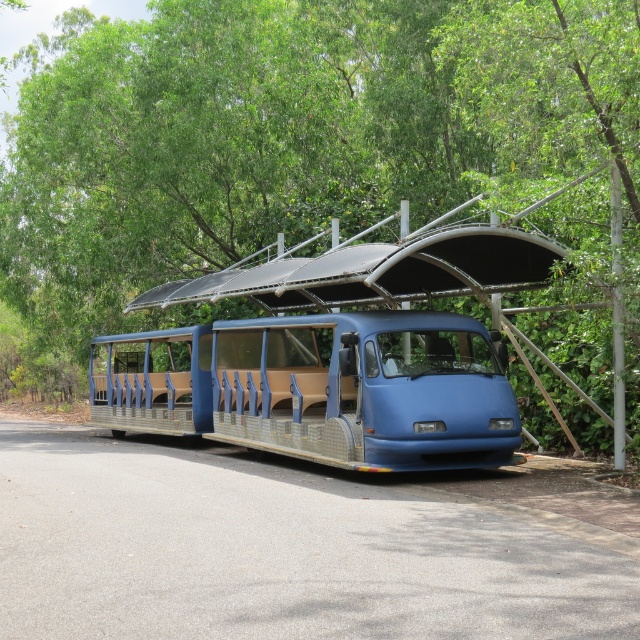
Does green leafy tree at upper center appear on the left side of blue matte/tactile tour bus at center?

Correct, you'll find green leafy tree at upper center to the left of blue matte/tactile tour bus at center.

Does green leafy tree at upper center appear over blue matte/tactile tour bus at center?

Yes, green leafy tree at upper center is above blue matte/tactile tour bus at center.

This screenshot has height=640, width=640. What do you see at coordinates (296, 138) in the screenshot? I see `green leafy tree at upper center` at bounding box center [296, 138].

The width and height of the screenshot is (640, 640). I want to click on green leafy tree at upper center, so click(x=296, y=138).